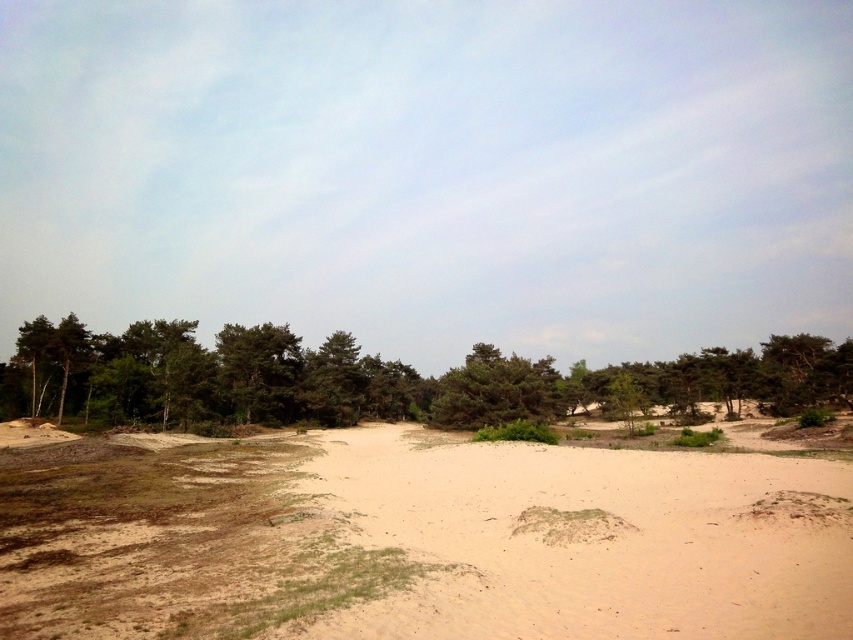
Question: Is light brown sandy ground at center thinner than green leafy trees at left?

Choices:
 (A) no
 (B) yes

Answer: (B)

Question: Does light brown sandy ground at center lie behind green leafy trees at left?

Choices:
 (A) yes
 (B) no

Answer: (B)

Question: Which point is closer to the camera?

Choices:
 (A) (386, 560)
 (B) (160, 321)

Answer: (A)

Question: Among these objects, which one is farthest from the camera?

Choices:
 (A) light brown sandy ground at center
 (B) green leafy trees at left

Answer: (B)

Question: Is light brown sandy ground at center positioned in front of green leafy trees at left?

Choices:
 (A) no
 (B) yes

Answer: (B)